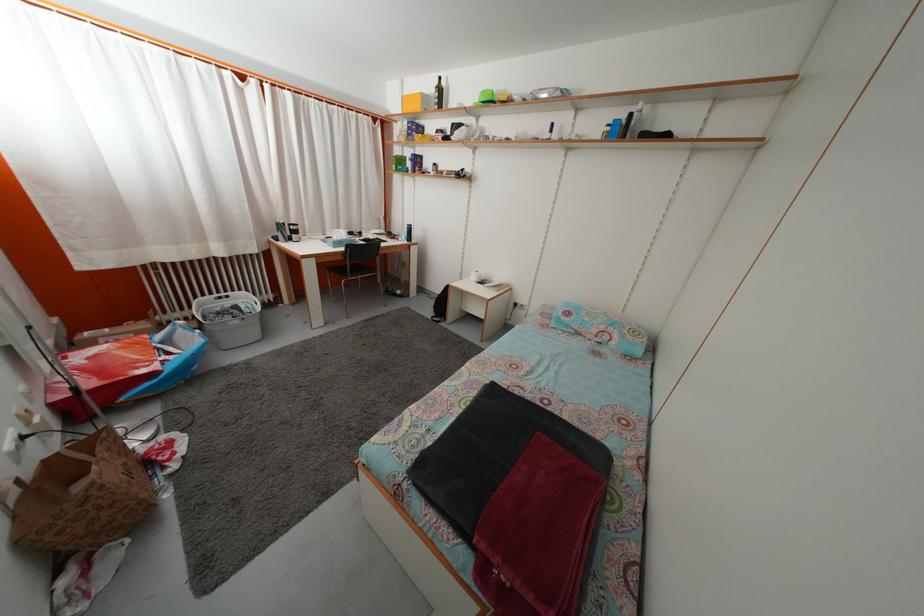
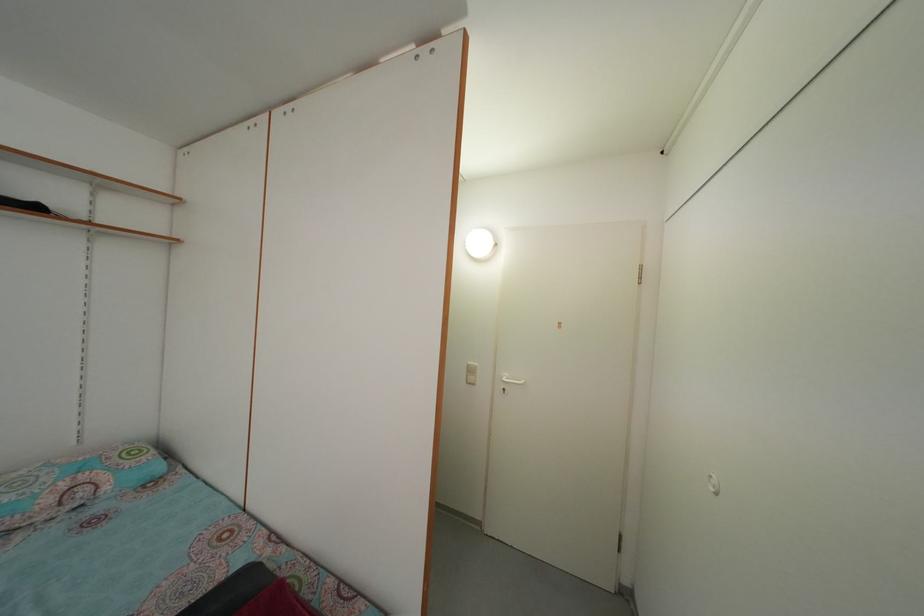
Question: Based on the continuous images, in which direction is the camera rotating? Reply with the corresponding letter.

Choices:
 (A) Left
 (B) Right
 (C) Up
 (D) Down

Answer: (B)